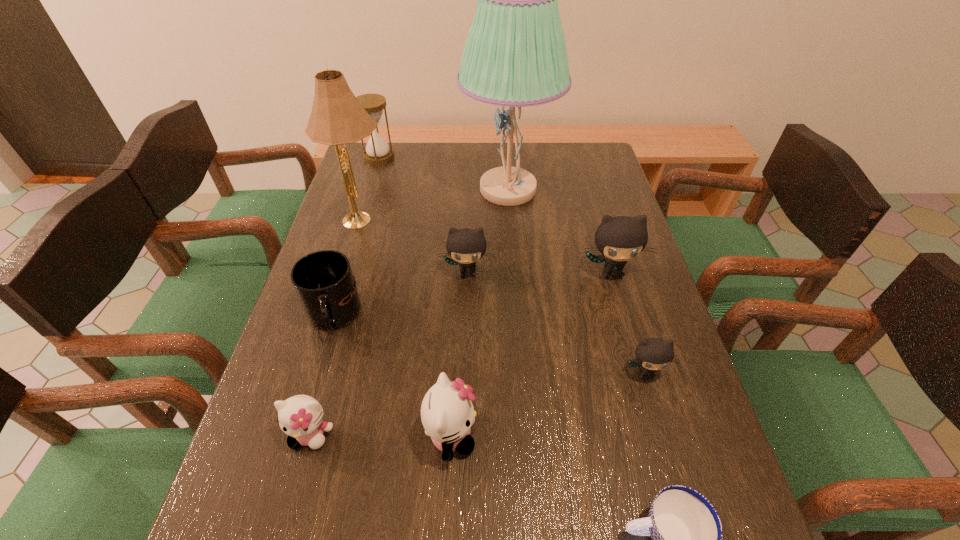
Locate an element on the screen. This screenshot has width=960, height=540. blank space at the far edge of the desktop is located at coordinates (545, 164).

Find the location of a particular element. vacant space at the left edge is located at coordinates (362, 265).

Find the location of `free location at the right edge of the desktop`. free location at the right edge of the desktop is located at coordinates (611, 208).

Locate an element on the screen. vacant space at the far left corner of the desktop is located at coordinates (379, 178).

Locate an element on the screen. The image size is (960, 540). vacant space at the far right corner is located at coordinates (581, 178).

Locate an element on the screen. free space between the tallest object and the mug is located at coordinates (420, 253).

Find the location of a particular element. free space that is in between the left white kitten and the right white kitten is located at coordinates (381, 435).

Find the location of a particular element. The width and height of the screenshot is (960, 540). free area in between the smaller white kitten and the seventh farthest object is located at coordinates 478,403.

You are a GUI agent. You are given a task and a screenshot of the screen. Output one action in this format:
    pyautogui.click(x=<x>, y=<y>)
    Task: Click on the empty space that is in between the black mug and the white hourglass
    The image size is (960, 540).
    Given the screenshot: What is the action you would take?
    pyautogui.click(x=356, y=237)

You are a GUI agent. You are given a task and a screenshot of the screen. Output one action in this format:
    pyautogui.click(x=<x>, y=<y>)
    Task: Click on the free spot between the biggest gray kitten and the second biggest gray kitten
    
    Given the screenshot: What is the action you would take?
    pyautogui.click(x=540, y=272)